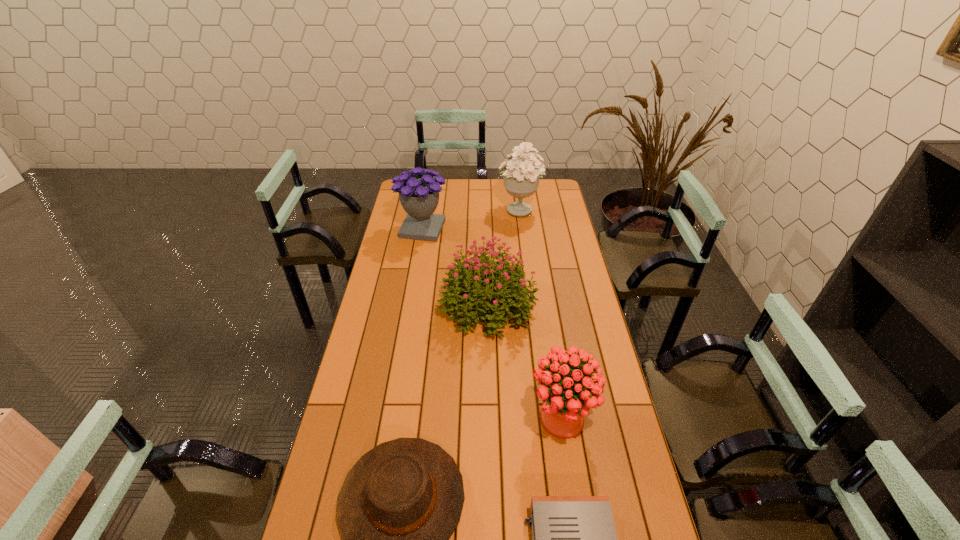
At what (x,y) coordinates should I click in order to perform the action: click on the fourth nearest object. Please return your answer as a coordinate pair (x, y). Looking at the image, I should click on (465, 287).

Locate an element on the screen. The image size is (960, 540). the nearest bouquet is located at coordinates [567, 396].

This screenshot has width=960, height=540. I want to click on vacant region located on the right of the fourth nearest object, so tap(550, 305).

Find the location of `vacant space situated 0.080m on the right of the nearest bouquet`. vacant space situated 0.080m on the right of the nearest bouquet is located at coordinates (620, 419).

At what (x,y) coordinates should I click in order to perform the action: click on object that is positioned at the far edge. Please return your answer as a coordinate pair (x, y). Looking at the image, I should click on (521, 179).

This screenshot has width=960, height=540. I want to click on object present at the left edge, so click(419, 195).

Locate an element on the screen. object at the far right corner is located at coordinates (521, 179).

Find the location of a particular element. free space at the far edge of the desktop is located at coordinates (532, 201).

Where is `free location at the left edge`? The image size is (960, 540). free location at the left edge is located at coordinates point(383,328).

You are a GUI agent. You are given a task and a screenshot of the screen. Output one action in this format:
    pyautogui.click(x=<x>, y=<y>)
    Task: Click on the free location at the right edge
    
    Given the screenshot: What is the action you would take?
    point(552,287)